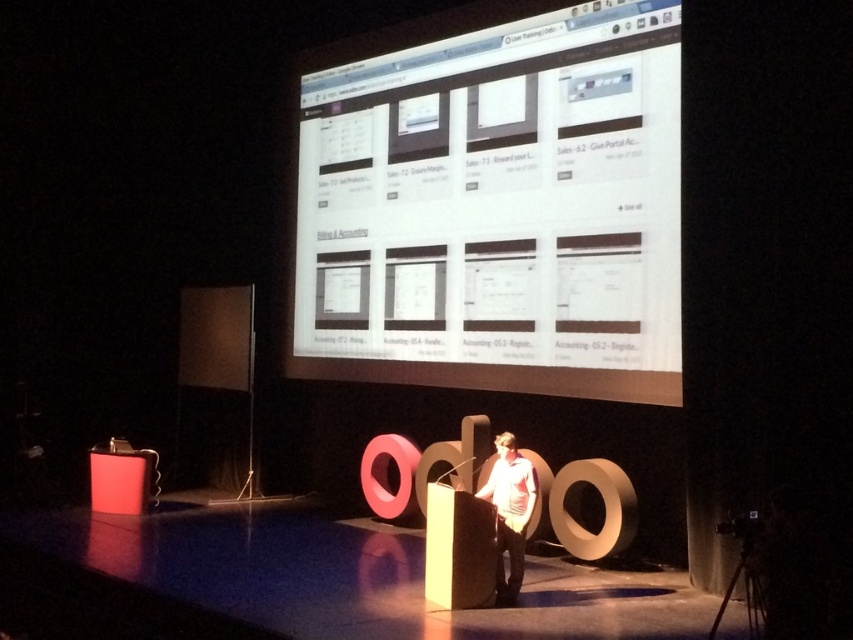
Measure the distance between white glossy computer screen at upper center and light pink fabric shirt at center.

white glossy computer screen at upper center is 2.09 meters away from light pink fabric shirt at center.

Is white glossy computer screen at upper center thinner than light pink fabric shirt at center?

No.

Find the location of a particular element. white glossy computer screen at upper center is located at coordinates (496, 205).